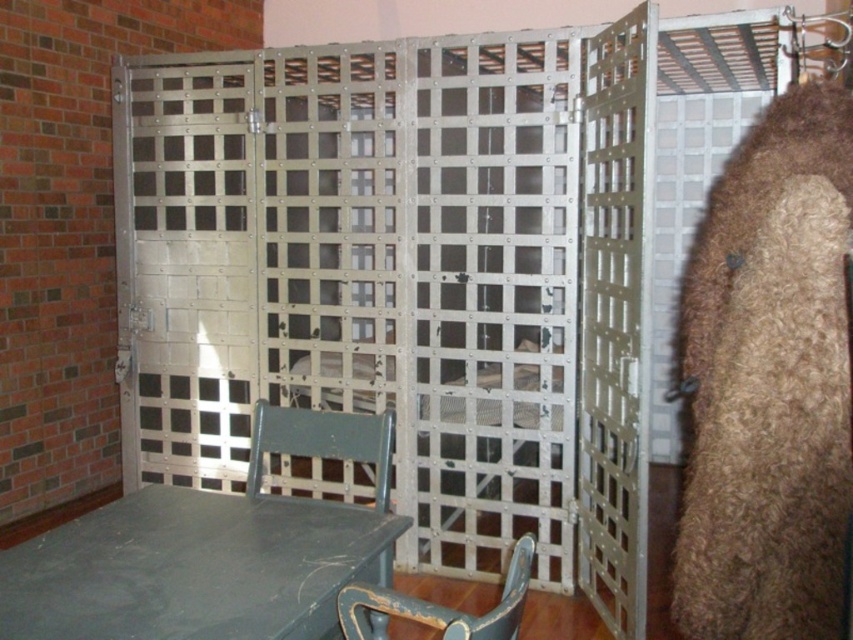
You are a visitor in a museum and see the metallic grid cage at center and the matte green chair at center. Which object takes up more space in the exhibit?

The metallic grid cage at center has a larger size compared to the matte green chair at center, so it takes up more space in the exhibit.

You are standing in front of a prison cell door and need to reach a point marked at coordinates [831,428]. If your arm can extend 1.8 meters, can you reach that point without moving closer?

The distance of point [831,428] is 2.04 meters from the camera. Since your arm can only extend 1.8 meters, you cannot reach the point without moving closer.